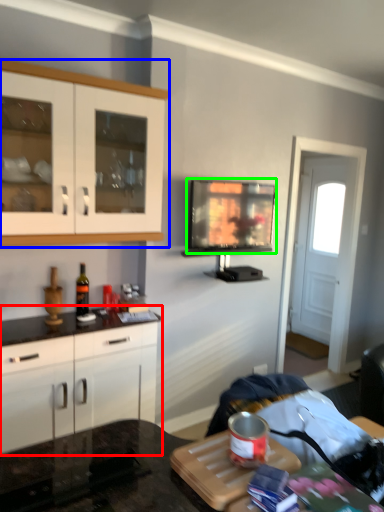
Question: Which object is the farthest from cabinetry (highlighted by a red box)? Choose among these: cabinetry (highlighted by a blue box) or television (highlighted by a green box).

Choices:
 (A) cabinetry
 (B) television

Answer: (B)